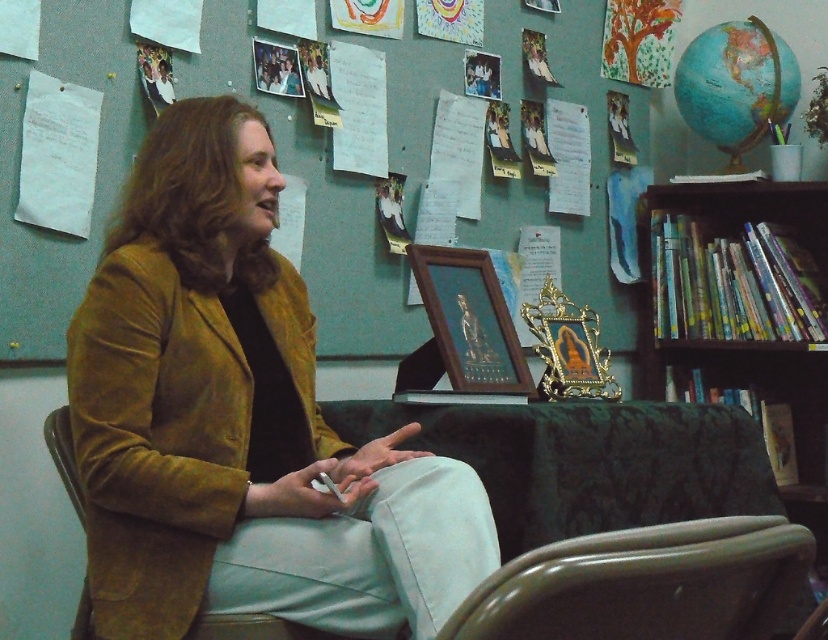
What are the coordinates of the velvet mustard jacket at center in the image?

The velvet mustard jacket at center is located at coordinates point (239,420).

You are an interior designer assessing the layout of this room. You notice the brown silky hair at upper left and the woodenobject at center. Which object takes up more space in the scene?

The woodenobject at center takes up more space in the scene because the brown silky hair at upper left has a smaller size compared to it.